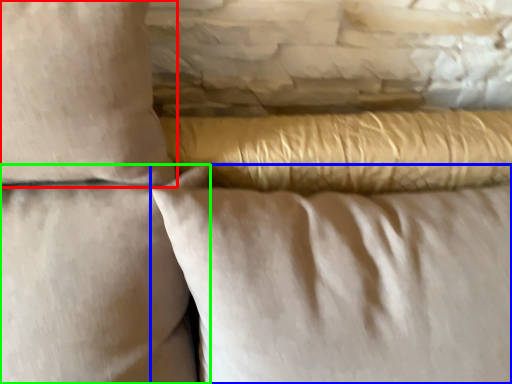
Question: Which object is the farthest from pillow (highlighted by a red box)? Choose among these: pillow (highlighted by a blue box) or pillow (highlighted by a green box).

Choices:
 (A) pillow
 (B) pillow

Answer: (A)